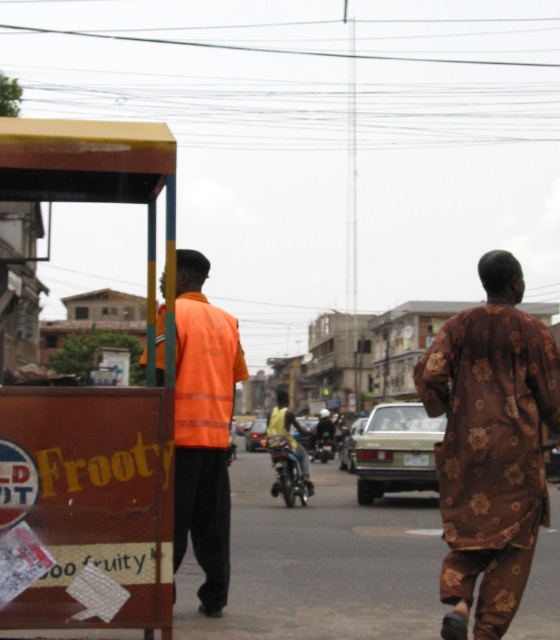
Which is more to the right, brown floral fabric robe at right or yellow metallic motorcycle at center?

From the viewer's perspective, brown floral fabric robe at right appears more on the right side.

Is brown floral fabric robe at right taller than yellow metallic motorcycle at center?

Yes.

Is point (520, 561) less distant than point (283, 481)?

Yes, point (520, 561) is in front of point (283, 481).

Identify the location of brown floral fabric robe at right. The height and width of the screenshot is (640, 560). (491, 451).

Where is `orange reflective vest at center`? orange reflective vest at center is located at coordinates (202, 428).

Does orange reflective vest at center have a larger size compared to yellow metallic motorcycle at center?

Indeed, orange reflective vest at center has a larger size compared to yellow metallic motorcycle at center.

Is point (198, 500) in front of point (287, 454)?

That is True.

Locate an element on the screen. orange reflective vest at center is located at coordinates (202, 428).

Can you confirm if brown floral fabric robe at right is positioned to the right of orange reflective vest at center?

Indeed, brown floral fabric robe at right is positioned on the right side of orange reflective vest at center.

Find the location of a particular element. brown floral fabric robe at right is located at coordinates (491, 451).

Is point (474, 468) behind point (206, 556)?

No, it is in front of (206, 556).

Where is `brown floral fabric robe at right`? The width and height of the screenshot is (560, 640). brown floral fabric robe at right is located at coordinates (491, 451).